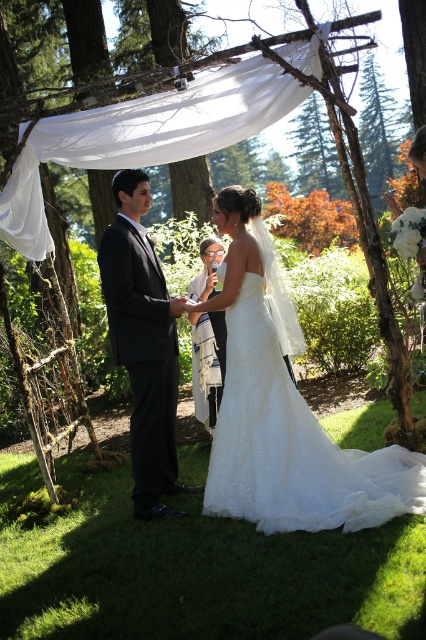
Question: Which of the following is the closest to the observer?

Choices:
 (A) (258, 387)
 (B) (164, 413)

Answer: (A)

Question: Is white lace wedding dress at center below black satin suit at center?

Choices:
 (A) yes
 (B) no

Answer: (A)

Question: Can you confirm if white lace wedding dress at center is wider than black satin suit at center?

Choices:
 (A) no
 (B) yes

Answer: (B)

Question: Which object appears closest to the camera in this image?

Choices:
 (A) white lace wedding dress at center
 (B) black satin suit at center

Answer: (A)

Question: Can you confirm if white lace wedding dress at center is positioned to the right of black satin suit at center?

Choices:
 (A) yes
 (B) no

Answer: (A)